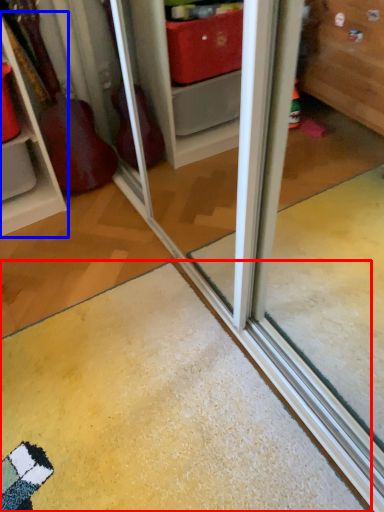
Question: Which object is further to the camera taking this photo, doormat (highlighted by a red box) or shelf (highlighted by a blue box)?

Choices:
 (A) doormat
 (B) shelf

Answer: (B)